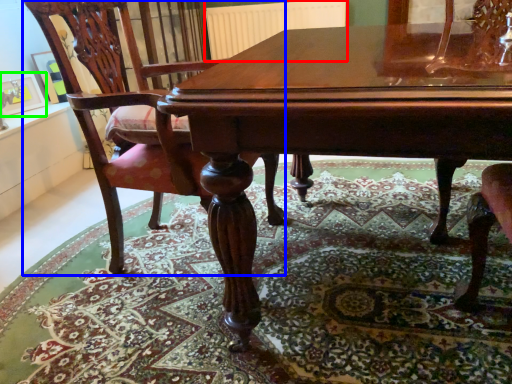
Question: Which is farther away from radiator (highlighted by a red box)? chair (highlighted by a blue box) or picture frame (highlighted by a green box)?

Choices:
 (A) chair
 (B) picture frame

Answer: (A)